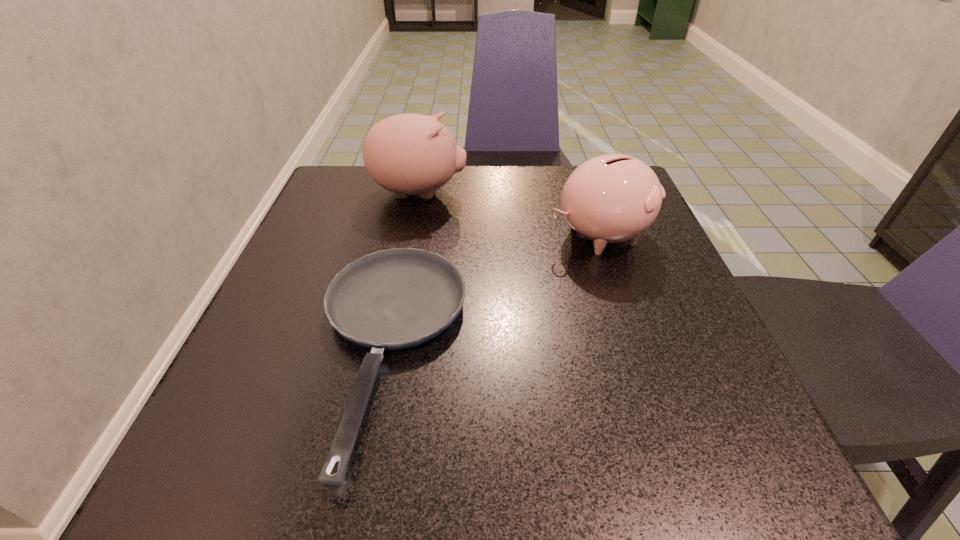
Locate an element on the screen. object situated at the far left corner is located at coordinates (408, 154).

Where is `object that is at the near left corner`? object that is at the near left corner is located at coordinates (392, 299).

This screenshot has height=540, width=960. In order to click on object located in the far right corner section of the desktop in this screenshot , I will do `click(611, 198)`.

Find the location of `vacant space at the far edge of the desktop`. vacant space at the far edge of the desktop is located at coordinates (388, 207).

This screenshot has width=960, height=540. In the image, there is a desktop. In order to click on vacant space at the near edge in this screenshot , I will do `click(402, 441)`.

What are the coordinates of `free location at the left edge` in the screenshot? It's located at (300, 234).

You are a GUI agent. You are given a task and a screenshot of the screen. Output one action in this format:
    pyautogui.click(x=<x>, y=<y>)
    Task: Click on the vacant area at the right edge
    The height and width of the screenshot is (540, 960).
    Given the screenshot: What is the action you would take?
    click(x=626, y=274)

In the image, there is a desktop. In order to click on vacant space at the far left corner in this screenshot , I will do `click(323, 198)`.

The width and height of the screenshot is (960, 540). What are the coordinates of `free region at the near left corner of the desktop` in the screenshot? It's located at click(x=209, y=490).

This screenshot has width=960, height=540. Find the location of `empty space that is in between the rightmost object and the left piggy bank`. empty space that is in between the rightmost object and the left piggy bank is located at coordinates (510, 214).